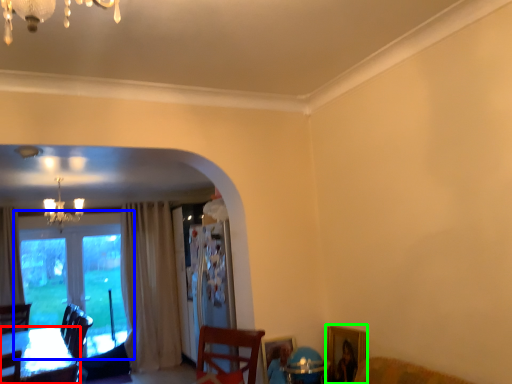
Question: Considering the real-world distances, which object is farthest from table (highlighted by a red box)? window (highlighted by a blue box) or picture frame (highlighted by a green box)?

Choices:
 (A) window
 (B) picture frame

Answer: (B)